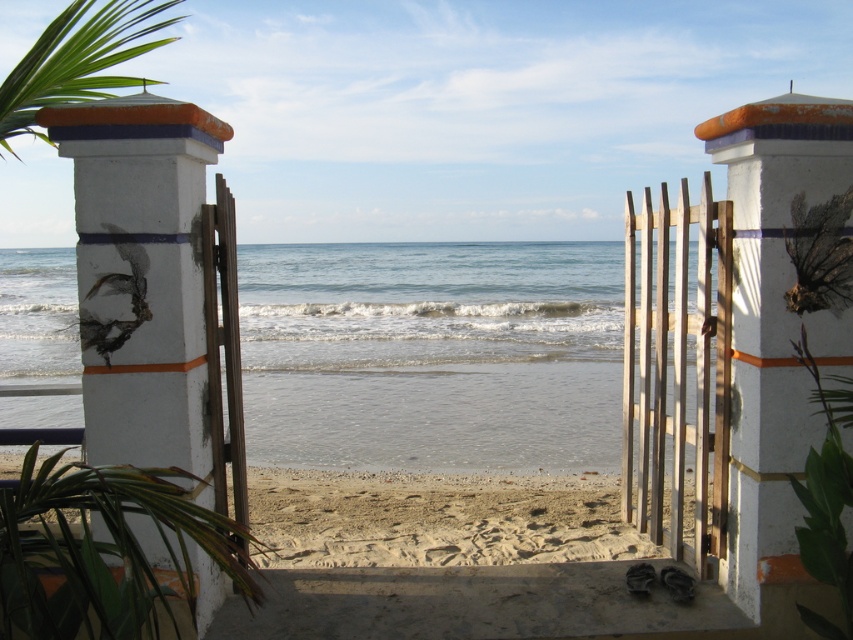
Question: Is the position of white painted concrete pillar at left less distant than that of beige sandy beach at center?

Choices:
 (A) yes
 (B) no

Answer: (A)

Question: Which object is closer to the camera taking this photo?

Choices:
 (A) beige sandy beach at center
 (B) white painted concrete pillar at right
 (C) green leafy palm at upper left

Answer: (B)

Question: Is white painted concrete pillar at right further to camera compared to white painted concrete pillar at left?

Choices:
 (A) no
 (B) yes

Answer: (A)

Question: Which is farther from the beige sandy beach at center?

Choices:
 (A) white painted concrete pillar at left
 (B) white painted concrete pillar at right

Answer: (B)

Question: Does white painted concrete pillar at right have a smaller size compared to beige sandy beach at center?

Choices:
 (A) no
 (B) yes

Answer: (B)

Question: Estimate the real-world distances between objects in this image. Which object is farther from the white painted concrete pillar at right?

Choices:
 (A) white painted concrete pillar at left
 (B) green leafy palm at upper left

Answer: (B)